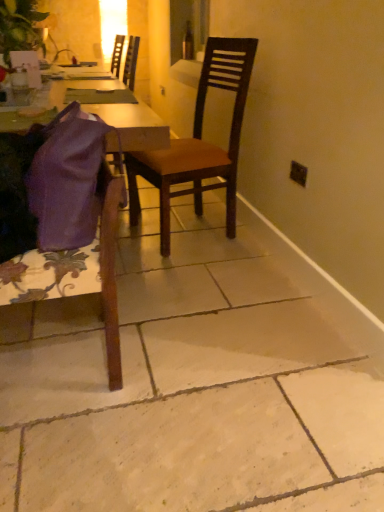
This screenshot has width=384, height=512. In order to click on unoccupied space behind purple fabric bag at lower left, the 2th chair from the back in this screenshot , I will do `click(100, 303)`.